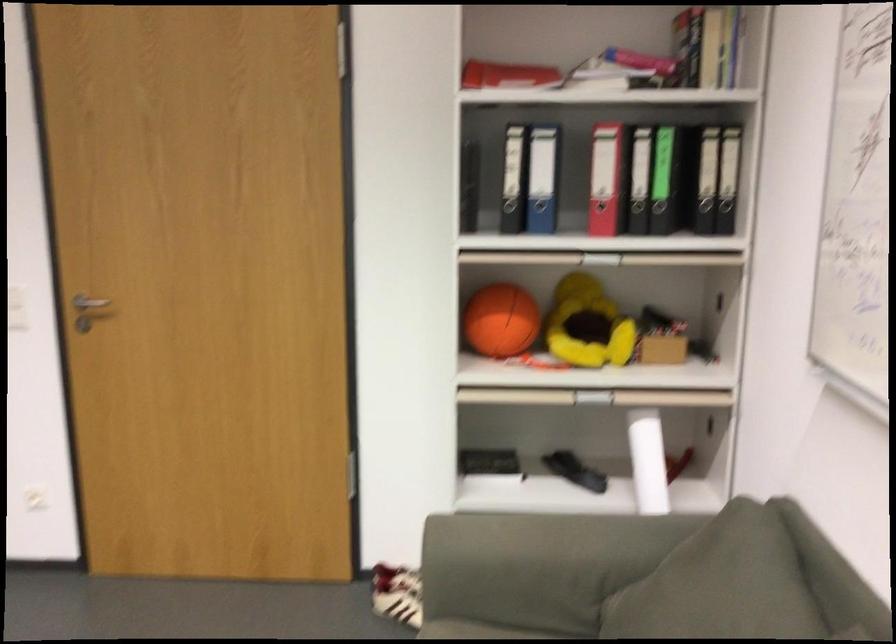
Describe the element at coordinates (747, 592) in the screenshot. I see `a sofa sitting surface` at that location.